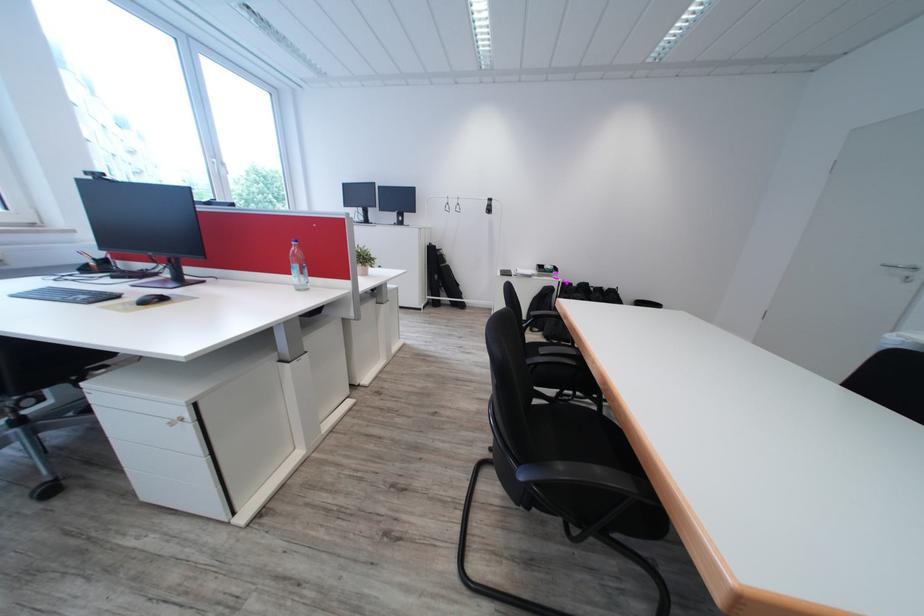
Find the location of `black chair armrest`. black chair armrest is located at coordinates (564, 381).